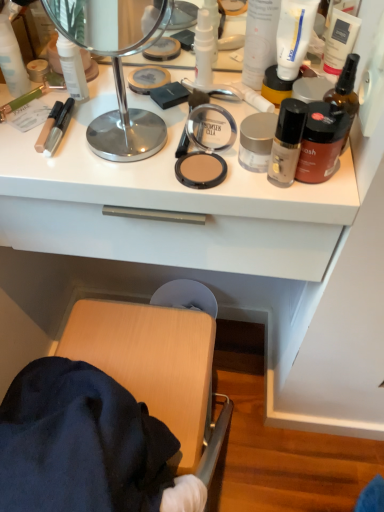
Locate an element on the screen. vacant space situated on the left part of matte black foundation at upper right, which is the 5th toiletry in right-to-left order is located at coordinates (165, 172).